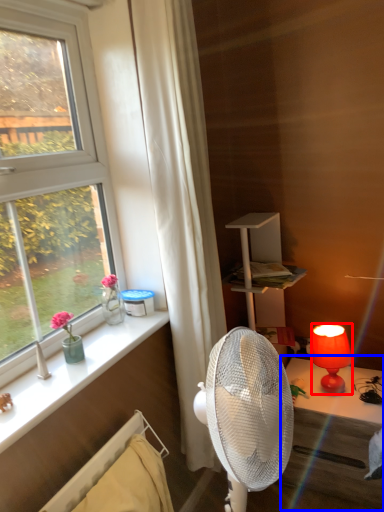
Question: Which point is further to the camera, lamp (highlighted by a red box) or table (highlighted by a blue box)?

Choices:
 (A) lamp
 (B) table

Answer: (A)